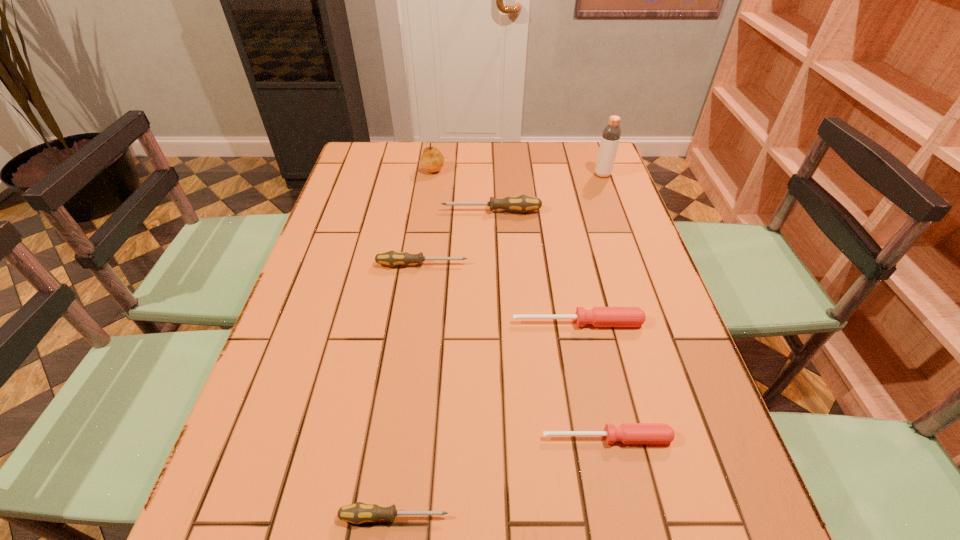
Identify which screwdriver is the nearest to the farthest screwdriver. Please provide its 2D coordinates. Your answer should be formatted as a tuple, i.e. [(x, y)], where the tuple contains the x and y coordinates of a point satisfying the conditions above.

[(392, 258)]

Point out which screwdriver is positioned as the second nearest to the pear. Please provide its 2D coordinates. Your answer should be formatted as a tuple, i.e. [(x, y)], where the tuple contains the x and y coordinates of a point satisfying the conditions above.

[(392, 258)]

Identify which gray screwdriver is the third closest to the pear. Please provide its 2D coordinates. Your answer should be formatted as a tuple, i.e. [(x, y)], where the tuple contains the x and y coordinates of a point satisfying the conditions above.

[(357, 513)]

Find the location of `gray screwdriver that is the closest to the fourth nearest screwdriver`. gray screwdriver that is the closest to the fourth nearest screwdriver is located at coordinates (523, 203).

At what (x,y) coordinates should I click in order to perform the action: click on red screwdriver that is the closest one to the nearest gray screwdriver. Please return your answer as a coordinate pair (x, y). This screenshot has height=540, width=960. Looking at the image, I should click on (628, 433).

Find the location of a particular element. vacant space that satisfies the following two spatial constraints: 1. on the front side of the pear; 2. on the left side of the third nearest screwdriver is located at coordinates (412, 323).

Locate an element on the screen. free space that satisfies the following two spatial constraints: 1. at the tip of the nearer red screwdriver; 2. on the right side of the fourth nearest object is located at coordinates tap(398, 438).

Find the location of a particular element. Image resolution: width=960 pixels, height=540 pixels. free point that satisfies the following two spatial constraints: 1. at the tip of the third nearest screwdriver; 2. on the right side of the second biggest gray screwdriver is located at coordinates (414, 323).

Find the location of a particular element. This screenshot has width=960, height=540. vacant area that satisfies the following two spatial constraints: 1. on the front side of the third nearest screwdriver; 2. on the left side of the second nearest object is located at coordinates (601, 438).

You are a GUI agent. You are given a task and a screenshot of the screen. Output one action in this format:
    pyautogui.click(x=<x>, y=<y>)
    Task: Click on the vacant space that satisfies the following two spatial constraints: 1. at the tip of the fifth nearest object; 2. on the back side of the second nearest screwdriver
    This screenshot has width=960, height=540.
    Given the screenshot: What is the action you would take?
    pyautogui.click(x=498, y=438)